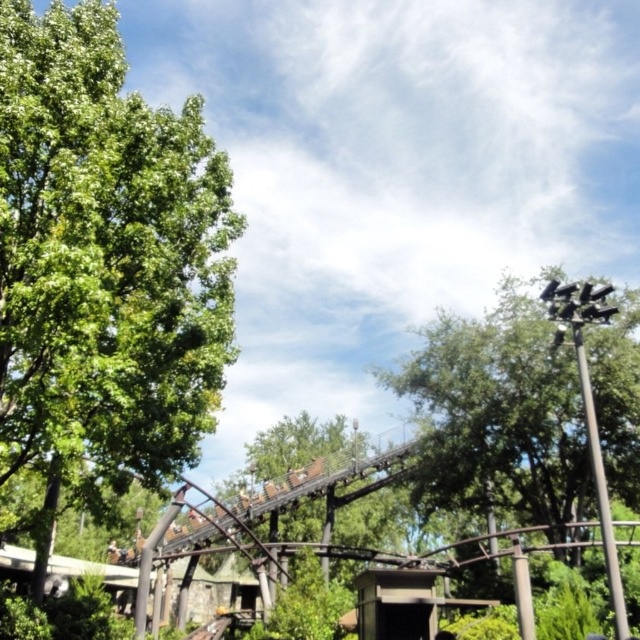
Who is more distant from viewer, (32, 154) or (392, 387)?

The point (392, 387) is behind.

Does green leafy tree at left have a larger size compared to green leafy tree at upper right?

Actually, green leafy tree at left might be smaller than green leafy tree at upper right.

Is point (54, 136) positioned in front of point (451, 348)?

Yes, point (54, 136) is in front of point (451, 348).

Where is `green leafy tree at left`? The height and width of the screenshot is (640, 640). green leafy tree at left is located at coordinates (104, 260).